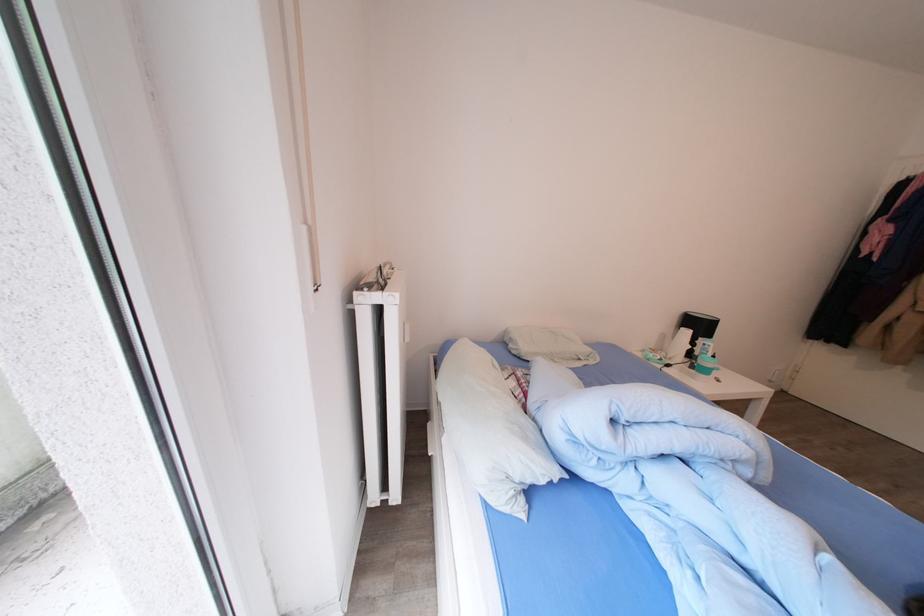
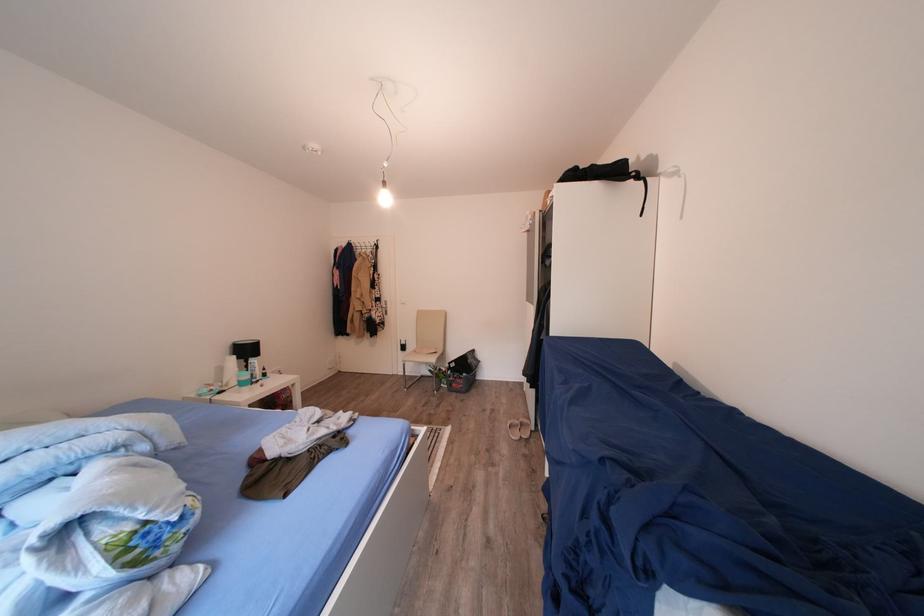
Question: Based on the continuous images, in which direction is the camera rotating? Reply with the corresponding letter.

Choices:
 (A) Left
 (B) Right
 (C) Up
 (D) Down

Answer: (B)